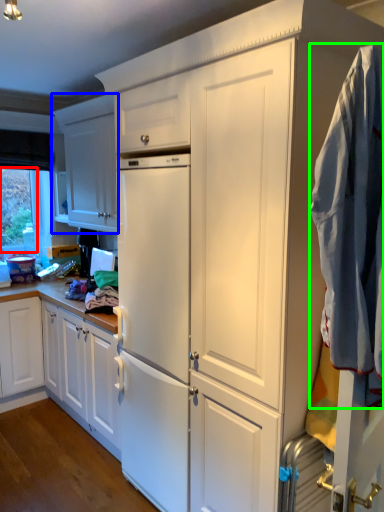
Question: Which is farther away from window screen (highlighted by a red box)? cabinetry (highlighted by a blue box) or clothing (highlighted by a green box)?

Choices:
 (A) cabinetry
 (B) clothing

Answer: (B)